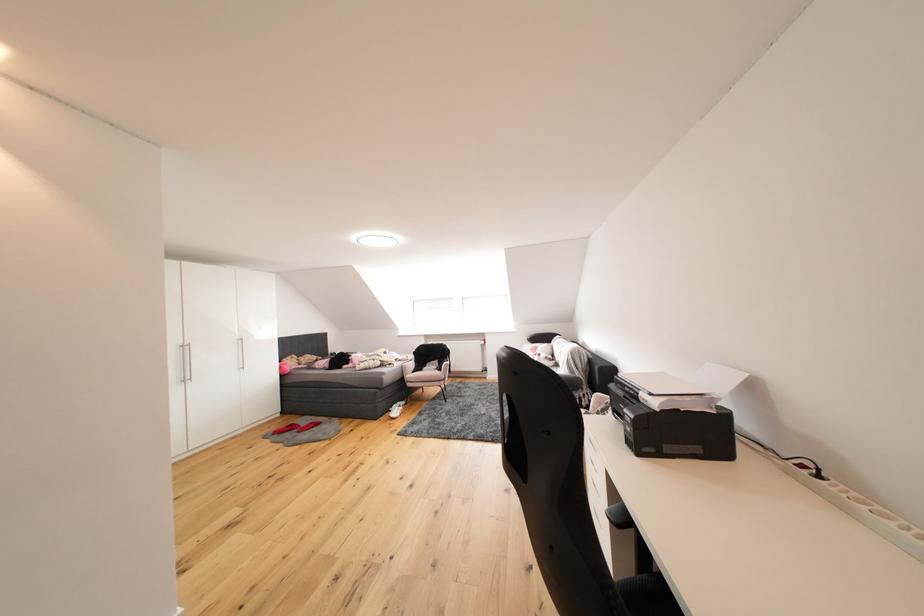
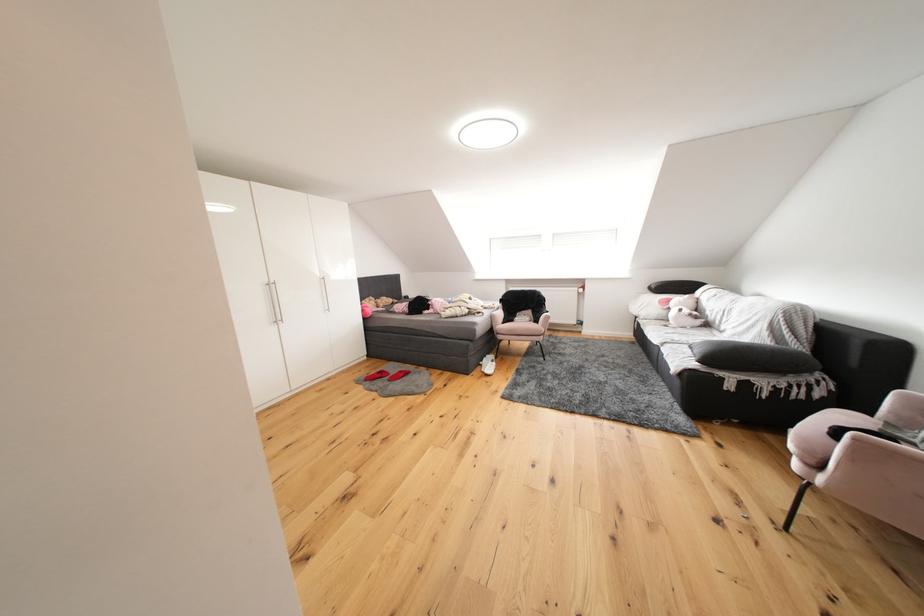
Question: How did the camera likely rotate?

Choices:
 (A) Left
 (B) Right
 (C) Up
 (D) Down

Answer: (D)